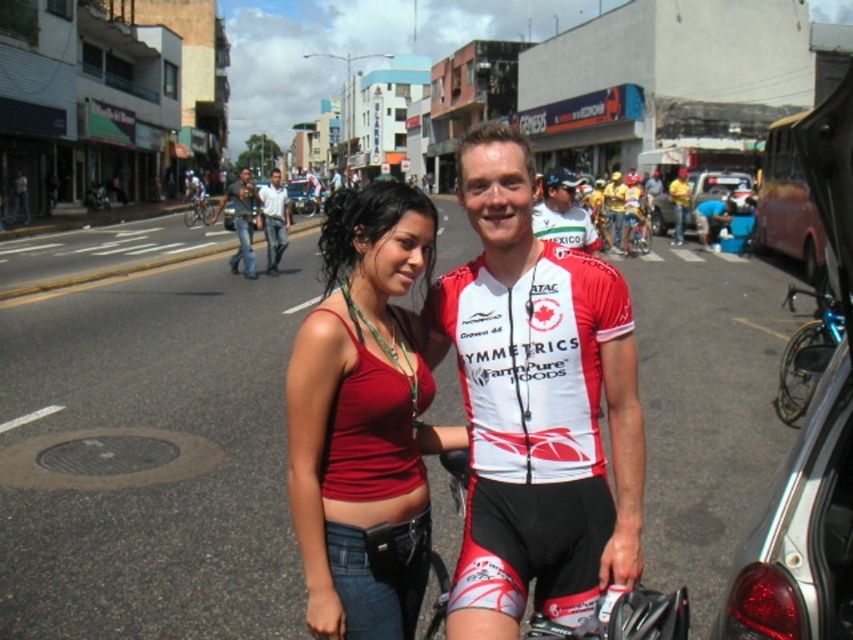
You are a photographer trying to capture a clear shot of the shiny metallic bicycle at right and the white jersey at center. Based on their positions, which object is closer to the camera?

The shiny metallic bicycle at right is positioned under the white jersey at center, so the white jersey at center is closer to the camera.

Based on the photo, you are a photographer trying to capture a clear shot of the shiny metallic bicycle at right and the white jersey at center. Which object should you zoom in on to ensure it appears narrower in your photo?

The shiny metallic bicycle at right is thinner than the white jersey at center, so you should zoom in on the shiny metallic bicycle at right to make it appear narrower in the photo.